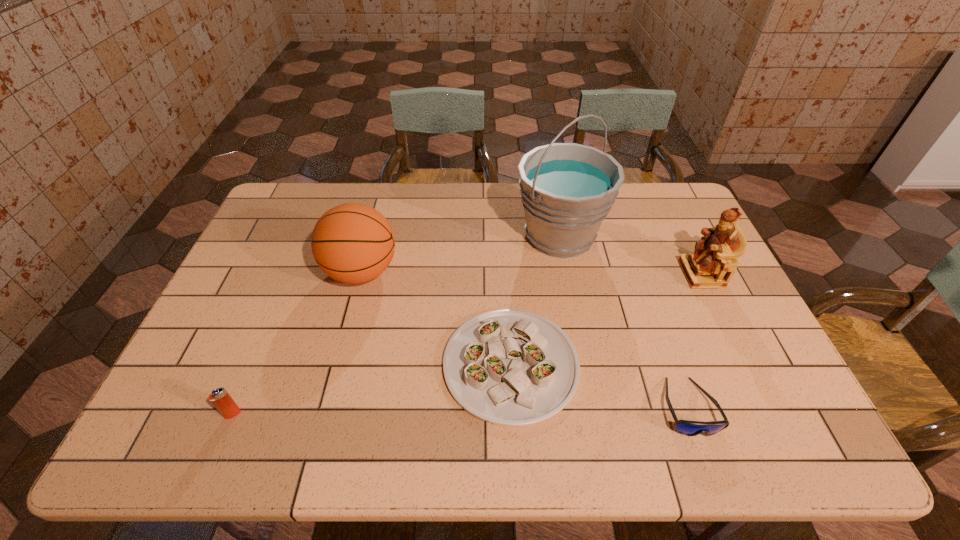
Find the location of a particular element. object present at the near left corner is located at coordinates (223, 402).

Where is `vacant region at the far edge of the desktop`? Image resolution: width=960 pixels, height=540 pixels. vacant region at the far edge of the desktop is located at coordinates (501, 183).

Locate an element on the screen. vacant region at the near edge of the desktop is located at coordinates (503, 443).

Find the location of a particular element. The width and height of the screenshot is (960, 540). free location at the left edge of the desktop is located at coordinates (276, 254).

Where is `free space at the right edge of the desktop`? The height and width of the screenshot is (540, 960). free space at the right edge of the desktop is located at coordinates (762, 357).

Where is `vacant space at the near right corner of the desktop`? vacant space at the near right corner of the desktop is located at coordinates (779, 429).

This screenshot has height=540, width=960. What are the coordinates of `vacant space in between the basketball and the bucket` in the screenshot? It's located at (461, 254).

The width and height of the screenshot is (960, 540). Identify the location of free space between the platter and the second object from left to right. (436, 318).

Locate an element on the screen. free spot between the fourth tallest object and the second object from left to right is located at coordinates (298, 343).

Identify the location of free space that is in between the platter and the sunglasses. click(599, 386).